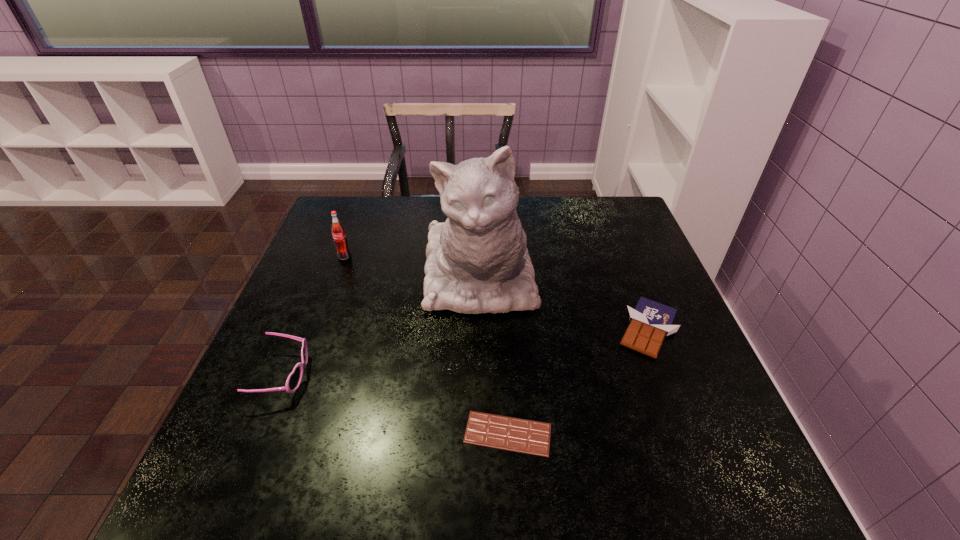
Identify the location of cat. Image resolution: width=960 pixels, height=540 pixels. (477, 261).

Where is `soda bottle`? The height and width of the screenshot is (540, 960). soda bottle is located at coordinates (338, 231).

You are a GUI agent. You are given a task and a screenshot of the screen. Output one action in this format:
    pyautogui.click(x=<x>, y=<y>)
    Task: Click on the third tallest object
    The width and height of the screenshot is (960, 540).
    Given the screenshot: What is the action you would take?
    (294, 379)

Find the location of a particular element. Image resolution: width=960 pixels, height=540 pixels. the farther chocolate bar is located at coordinates (650, 321).

Locate an element on the screen. This screenshot has width=960, height=540. the right chocolate bar is located at coordinates (650, 321).

Where is `the nearer chocolate bar`? The image size is (960, 540). the nearer chocolate bar is located at coordinates (525, 436).

Find the location of a particular element. This screenshot has height=540, width=960. the nearest object is located at coordinates (525, 436).

Locate an element on the screen. vacant space located 0.230m on the front-facing side of the tallest object is located at coordinates (479, 427).

Identify the location of free space located on the label of the second tallest object. The image size is (960, 540). (300, 378).

Image resolution: width=960 pixels, height=540 pixels. I want to click on vacant area situated 0.050m on the front-facing side of the sunglasses, so click(x=332, y=375).